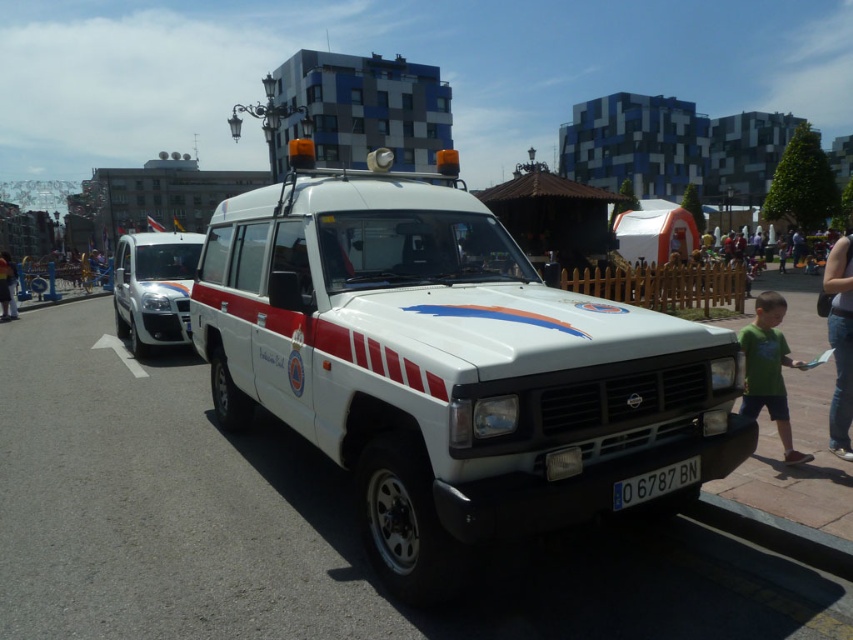
Looking at this image, which of these two, white matte fire truck at center or white glossy van at left, stands taller?

Standing taller between the two is white glossy van at left.

Is point (432, 506) positioned before point (149, 248)?

Yes.

Which is behind, point (573, 486) or point (181, 268)?

Point (181, 268)

I want to click on white matte fire truck at center, so click(x=447, y=365).

Does white glossy van at left appear on the left side of black plastic license plate at center?

Yes, white glossy van at left is to the left of black plastic license plate at center.

Does point (144, 285) come behind point (651, 477)?

That is True.

What are the coordinates of `white glossy van at left` in the screenshot? It's located at (154, 289).

Can you confirm if white matte fire truck at center is smaller than black plastic license plate at center?

Actually, white matte fire truck at center might be larger than black plastic license plate at center.

Which is above, white matte fire truck at center or black plastic license plate at center?

Positioned higher is white matte fire truck at center.

Find the location of `white matte fire truck at center`. white matte fire truck at center is located at coordinates (447, 365).

The width and height of the screenshot is (853, 640). Identify the location of white matte fire truck at center. (447, 365).